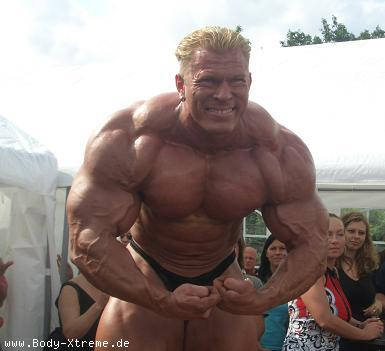
Locate an element on the screen. rod is located at coordinates (194, 215).